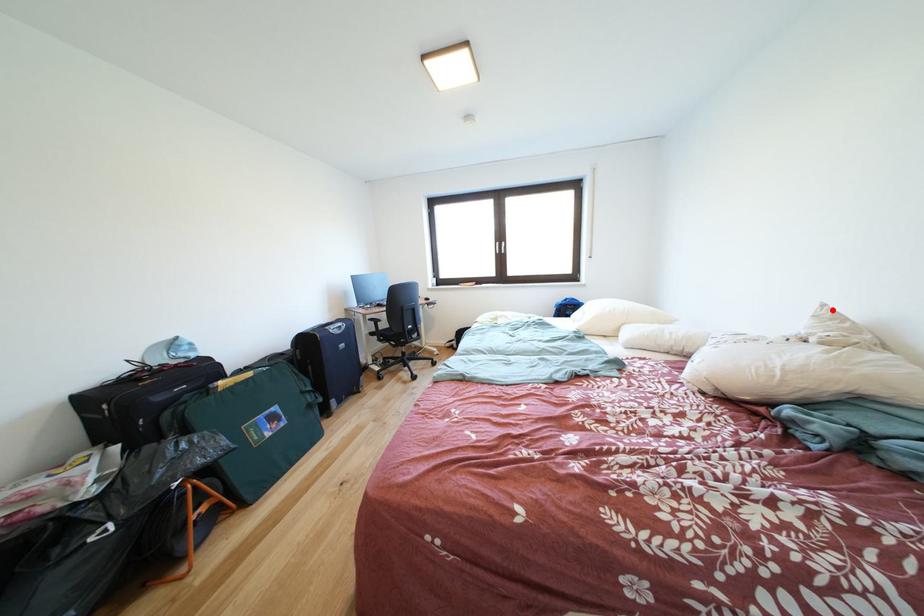
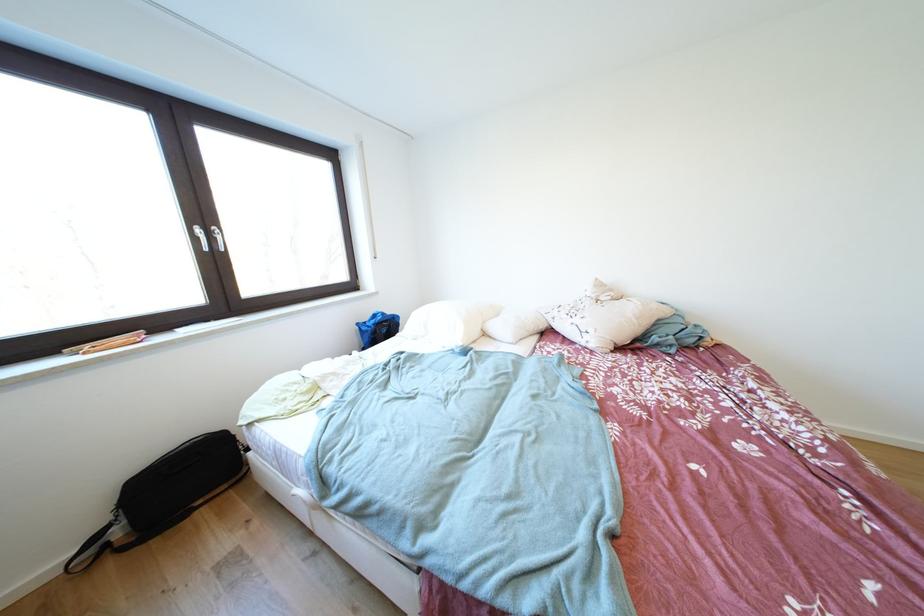
Where in the second image is the point corresponding to the highlighted location from the first image?

(604, 284)